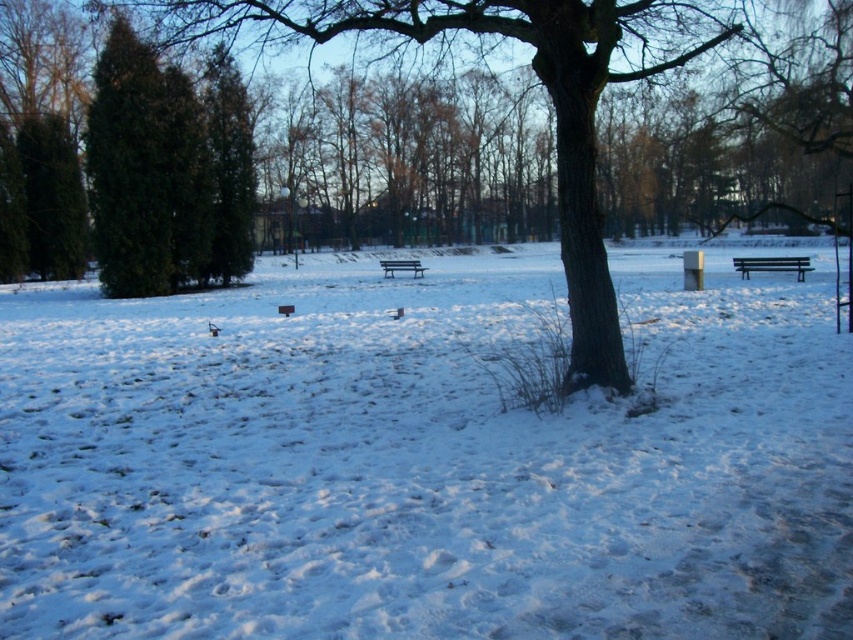
You are planning to take a photo of the brown rough tree trunk at center and the wooden bench at center from a distance. Which object will appear larger in the photo?

The brown rough tree trunk at center will appear larger in the photo because it is taller than the wooden bench at center.

You are standing at the edge of the park and want to sit on one of the wooden benches. If you first walk towards the wooden bench at right and then decide to move to the wooden bench at center, which direction should you walk relative to your current position?

Since the wooden bench at right is in front of the wooden bench at center, you should walk towards the wooden bench at center by moving behind the wooden bench at right.